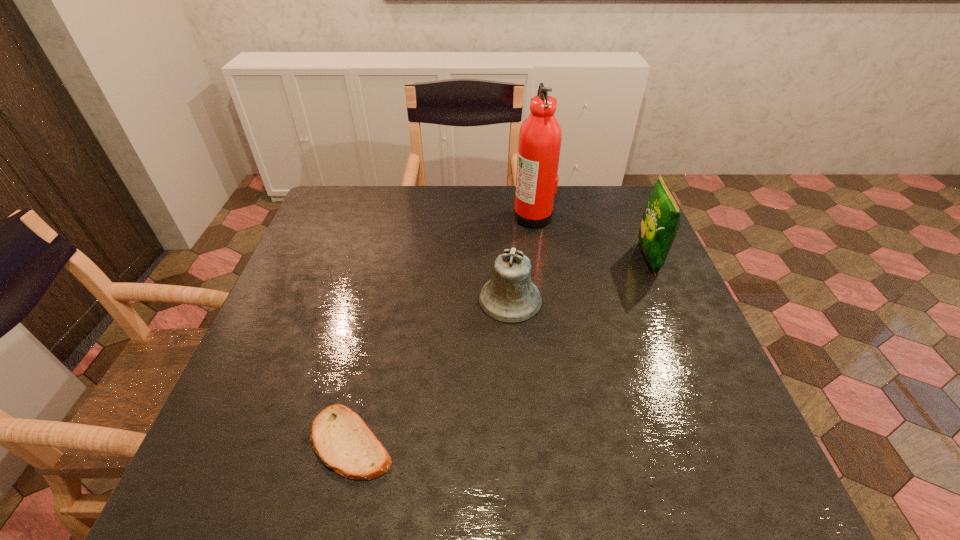
Identify the location of vacant space located on the label side of the farthest object. (423, 215).

Image resolution: width=960 pixels, height=540 pixels. I want to click on vacant space located 0.300m on the front-facing side of the rightmost object, so click(530, 258).

Where is `free location located on the front-facing side of the rightmost object`? free location located on the front-facing side of the rightmost object is located at coordinates (577, 258).

Identify the location of vacant area situated 0.370m on the front-facing side of the rightmost object. (505, 258).

This screenshot has height=540, width=960. What are the coordinates of `blank space located 0.290m on the front of the bell` in the screenshot? It's located at (520, 438).

The height and width of the screenshot is (540, 960). Identify the location of vacant space located on the back of the leftmost object. (383, 301).

The height and width of the screenshot is (540, 960). I want to click on object located at the far edge, so click(x=540, y=137).

Locate an element on the screen. Image resolution: width=960 pixels, height=540 pixels. object located at the near edge is located at coordinates (341, 439).

The width and height of the screenshot is (960, 540). In order to click on object positioned at the right edge in this screenshot , I will do `click(660, 223)`.

Identify the location of free spot at the far edge of the desktop. The height and width of the screenshot is (540, 960). (434, 225).